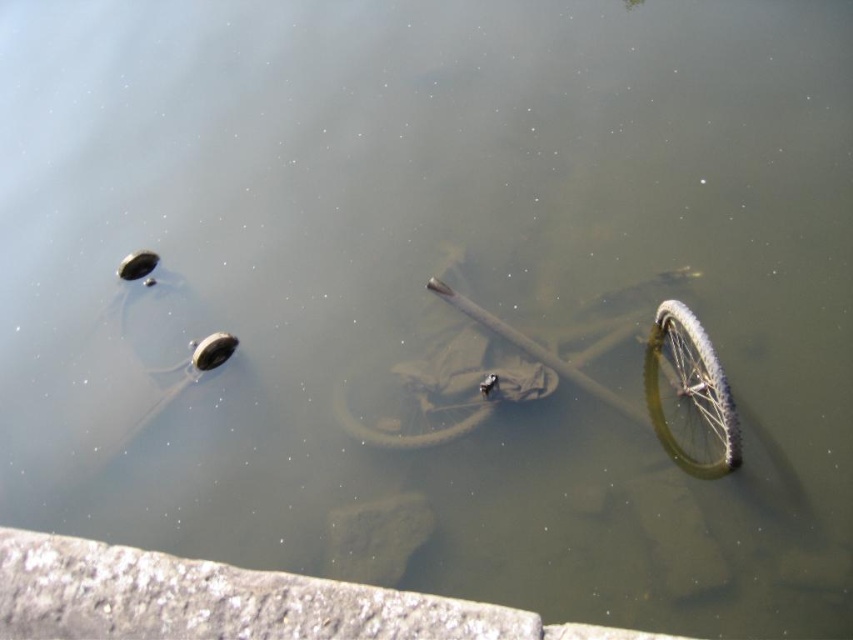
You are standing at the camera position and want to retrieve the green rubber bicycle at center from the water. If your maximum reach distance without moving is 4 meters, can you reach it?

The green rubber bicycle at center and camera are 4.48 meters apart from each other. Since your maximum reach is 4 meters, you cannot reach the green rubber bicycle at center without moving closer.

You are a diver exploring the submerged scene. You see the green rubber bicycle at center and the green rubber tire at lower right. Which object is closer to the left side of the scene?

The green rubber bicycle at center is positioned on the left side of green rubber tire at lower right, so it is closer to the left side of the scene.

You are a diver exploring the submerged objects in the pond. You see the green rubber bicycle at center and the green rubber tire at center. Which object is bigger in size?

The green rubber bicycle at center is larger in size compared to the green rubber tire at center.